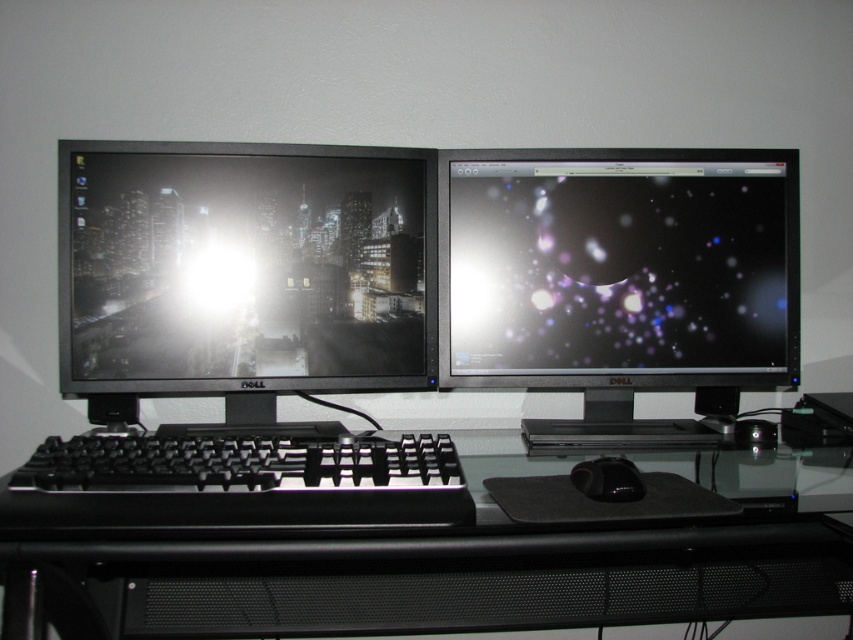
Question: Can you confirm if matte black monitor at right is positioned above black plastic keyboard at center?

Choices:
 (A) no
 (B) yes

Answer: (B)

Question: Is the position of matte black monitor at right less distant than that of black plastic keyboard at center?

Choices:
 (A) yes
 (B) no

Answer: (B)

Question: Which point is farther from the camera taking this photo?

Choices:
 (A) (759, 161)
 (B) (32, 454)
 (C) (306, 352)

Answer: (B)

Question: Which object is the farthest from the matte black monitor at left?

Choices:
 (A) matte black monitor at right
 (B) black glass computer desk at center
 (C) black plastic keyboard at center

Answer: (B)

Question: Is matte black monitor at left positioned before black plastic keyboard at center?

Choices:
 (A) no
 (B) yes

Answer: (A)

Question: Which object is the farthest from the black rubber mouse at center?

Choices:
 (A) matte black monitor at right
 (B) black glass computer desk at center
 (C) black plastic keyboard at center

Answer: (A)